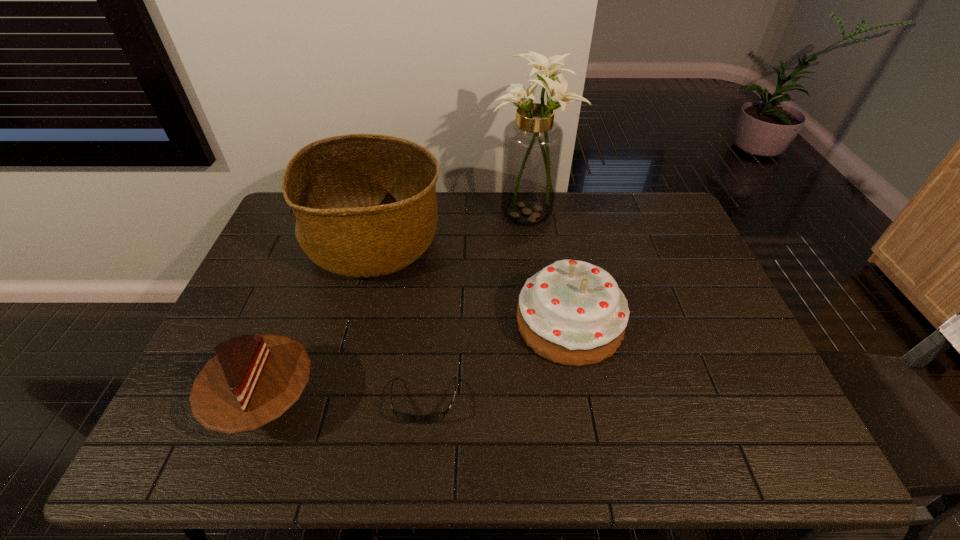
The height and width of the screenshot is (540, 960). In order to click on the tallest object in this screenshot , I will do `click(532, 144)`.

I want to click on the fourth shortest object, so click(366, 206).

Image resolution: width=960 pixels, height=540 pixels. In order to click on the right cake in this screenshot , I will do `click(573, 313)`.

I want to click on the shorter cake, so click(252, 380).

At what (x,y) coordinates should I click in order to perform the action: click on the fourth tallest object. Please return your answer as a coordinate pair (x, y). The width and height of the screenshot is (960, 540). Looking at the image, I should click on (252, 380).

In order to click on the shortest object in this screenshot , I will do 436,417.

Locate an element on the screen. blank space located on the right of the tallest object is located at coordinates (675, 213).

I want to click on vacant space located 0.080m on the right of the second tallest object, so click(x=469, y=243).

Find the location of a particular element. vacant space located 0.070m on the back of the right cake is located at coordinates (560, 269).

Locate an element on the screen. free region located on the back of the left cake is located at coordinates (316, 271).